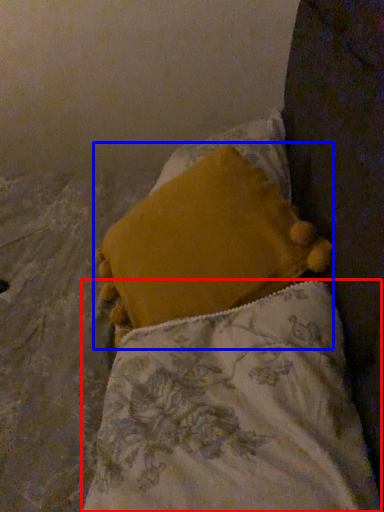
Question: Which of the following is the farthest to the observer, pillow (highlighted by a red box) or pillow (highlighted by a blue box)?

Choices:
 (A) pillow
 (B) pillow

Answer: (B)